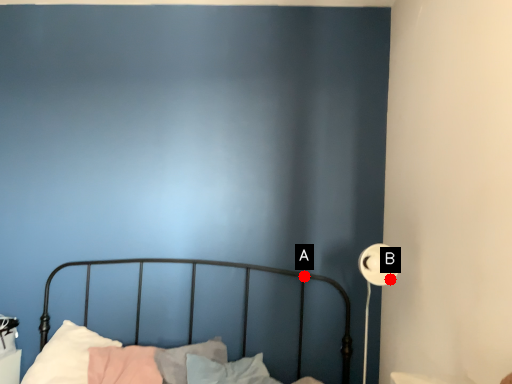
Question: Two points are circled on the image, labeled by A and B beside each circle. Which point is farther from the camera taking this photo?

Choices:
 (A) A is further
 (B) B is further

Answer: (A)